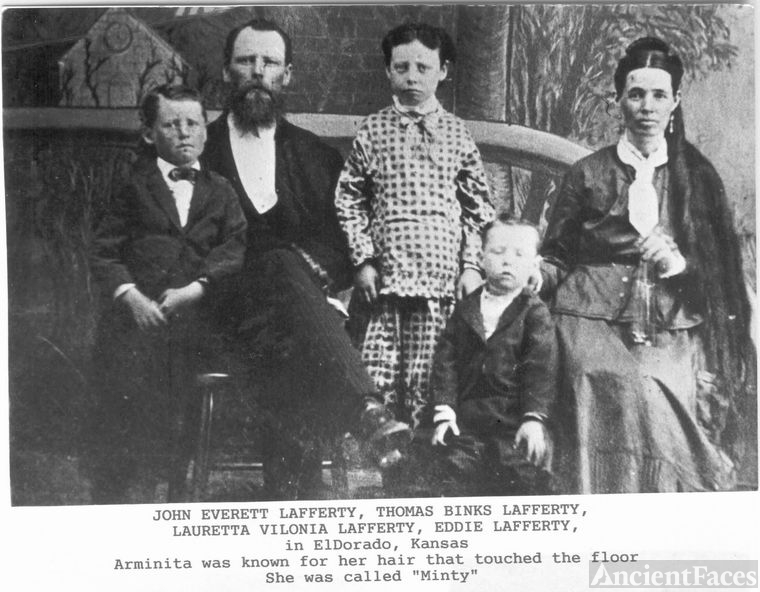
At what (x,y) coordinates should I click in order to perform the action: click on stool/chair. Please return your answer as a coordinate pair (x, y). Looking at the image, I should click on (213, 378).